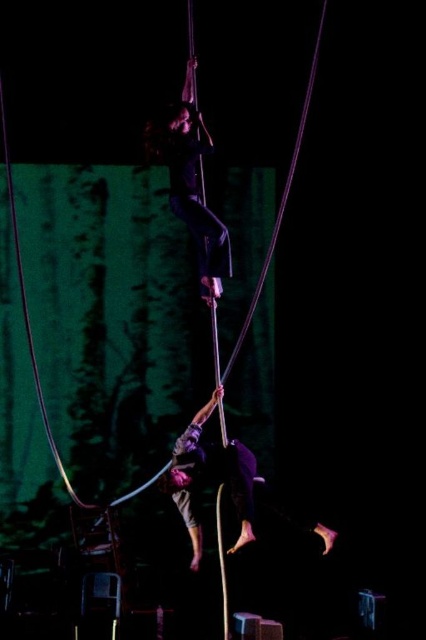
Question: Estimate the real-world distances between objects in this image. Which object is farther from the black matte pants at upper center?

Choices:
 (A) dark purple fabric pole at lower center
 (B) smooth blue rope at upper center

Answer: (B)

Question: Can you confirm if black matte pants at upper center is positioned to the left of dark purple fabric pole at lower center?

Choices:
 (A) yes
 (B) no

Answer: (A)

Question: Is dark purple fabric pole at lower center below smooth blue rope at upper center?

Choices:
 (A) no
 (B) yes

Answer: (A)

Question: Which object is farther from the camera taking this photo?

Choices:
 (A) smooth blue rope at upper center
 (B) black matte pants at upper center

Answer: (A)

Question: Can you confirm if dark purple fabric pole at lower center is positioned below smooth blue rope at upper center?

Choices:
 (A) yes
 (B) no

Answer: (B)

Question: Which point appears closest to the camera in this image?

Choices:
 (A) click(x=192, y=198)
 (B) click(x=293, y=163)
 (C) click(x=247, y=467)

Answer: (B)